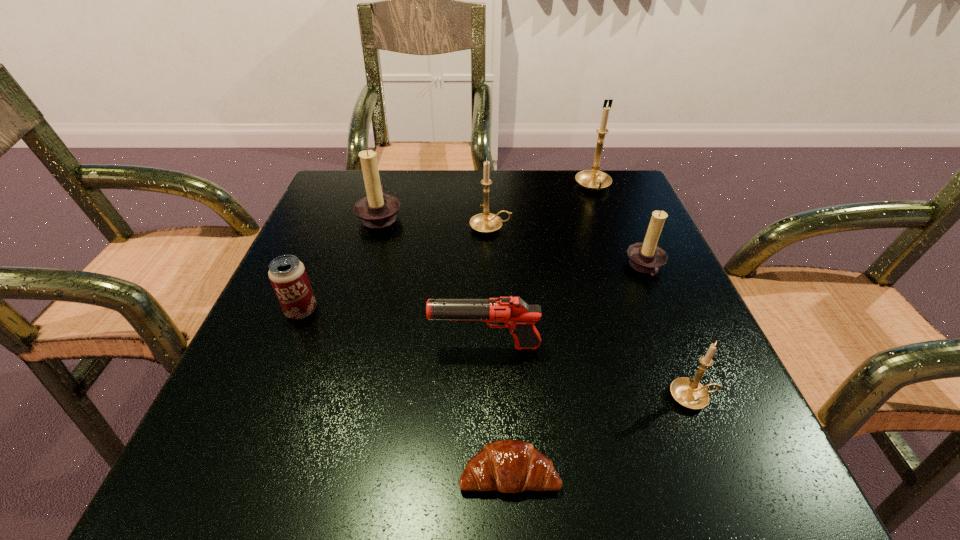
Locate an element on the screen. This screenshot has width=960, height=540. object at the far left corner is located at coordinates (377, 210).

Identify the location of object present at the far right corner. The image size is (960, 540). (593, 179).

Image resolution: width=960 pixels, height=540 pixels. Find the location of `vacant region at the far edge of the desktop`. vacant region at the far edge of the desktop is located at coordinates (460, 187).

Identify the location of vacant area at the near edge. The width and height of the screenshot is (960, 540). (646, 474).

Identify the location of blank area at the left edge. (352, 277).

The height and width of the screenshot is (540, 960). In the image, there is a desktop. What are the coordinates of `vacant space at the right edge` in the screenshot? It's located at (692, 410).

In the image, there is a desktop. At what (x,y) coordinates should I click in order to perform the action: click on vacant space at the far left corner. Please return your answer as a coordinate pair (x, y). This screenshot has height=540, width=960. Looking at the image, I should click on (348, 169).

The height and width of the screenshot is (540, 960). Find the location of `vacant area at the near left corner`. vacant area at the near left corner is located at coordinates (277, 459).

Locate an element on the screen. This screenshot has height=540, width=960. free space at the near right corner of the desktop is located at coordinates (745, 480).

Where is `vacant point located between the nearest gold candle holder and the biggest gold candle holder`? The height and width of the screenshot is (540, 960). vacant point located between the nearest gold candle holder and the biggest gold candle holder is located at coordinates (643, 292).